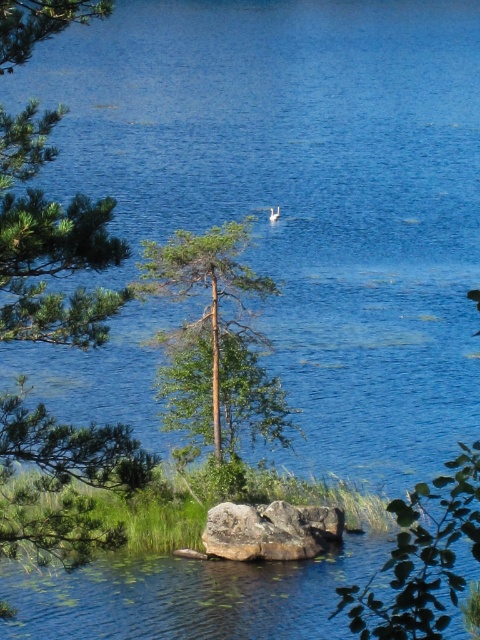
From the picture: Is green leafy tree at left above green leafy tree at center?

No.

In order to click on green leafy tree at left in this screenshot , I will do `click(49, 244)`.

Who is more forward, (x=149, y=468) or (x=192, y=362)?

Point (x=149, y=468) is in front.

Find the location of a particular element. The width and height of the screenshot is (480, 640). green leafy tree at left is located at coordinates (49, 244).

Does point (267, 394) come closer to viewer compared to point (260, 536)?

No, (267, 394) is further to viewer.

Can you confirm if green leafy tree at center is shorter than brown rough rock at center?

Indeed, green leafy tree at center has a lesser height compared to brown rough rock at center.

Where is `green leafy tree at center`? This screenshot has height=640, width=480. green leafy tree at center is located at coordinates (214, 340).

What are the coordinates of `green leafy tree at center` in the screenshot? It's located at (214, 340).

Does green leafy tree at left appear on the left side of brown rough rock at center?

Indeed, green leafy tree at left is positioned on the left side of brown rough rock at center.

Which of these two, green leafy tree at left or brown rough rock at center, stands shorter?

brown rough rock at center

Is point (45, 157) behind point (285, 509)?

No, (45, 157) is closer to viewer.

At what (x,y) coordinates should I click in order to perform the action: click on green leafy tree at left. Please return your answer as a coordinate pair (x, y). Looking at the image, I should click on (49, 244).